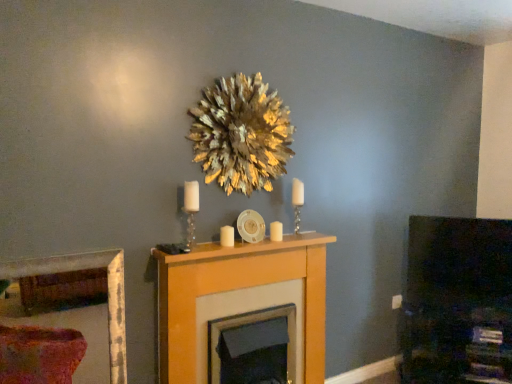
Where is `unoccupied region to the right of white matte candle at center, acting as the 2th candle starting from the right`? The height and width of the screenshot is (384, 512). unoccupied region to the right of white matte candle at center, acting as the 2th candle starting from the right is located at coordinates (250, 247).